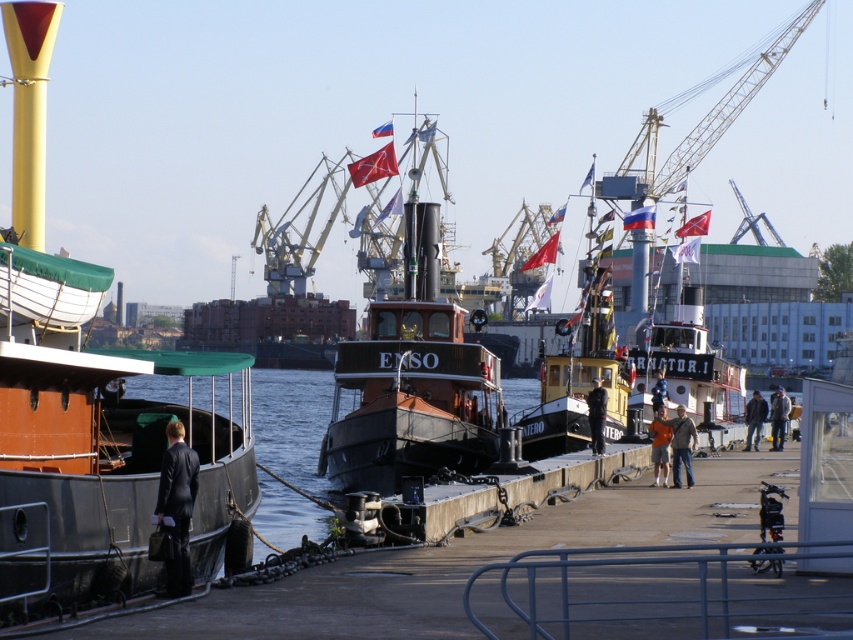
Consider the image. Does brown leather jacket at lower right appear on the right side of red fabric flag at center?

Yes, brown leather jacket at lower right is to the right of red fabric flag at center.

Is point (753, 419) behind point (695, 216)?

No, it is not.

The image size is (853, 640). I want to click on brown leather jacket at lower right, so (x=753, y=419).

Find the location of a particular element. light brown leather jacket at lower right is located at coordinates (682, 444).

Image resolution: width=853 pixels, height=640 pixels. What are the coordinates of `light brown leather jacket at lower right` in the screenshot? It's located at (682, 444).

Can you confirm if brown wooden tugboat at center is positioned to the right of orange cotton shirt at center?

No, brown wooden tugboat at center is not to the right of orange cotton shirt at center.

Can you confirm if brown wooden tugboat at center is wider than orange cotton shirt at center?

Correct, the width of brown wooden tugboat at center exceeds that of orange cotton shirt at center.

Is point (471, 400) closer to camera compared to point (654, 426)?

That is False.

Identify the location of brown wooden tugboat at center. Image resolution: width=853 pixels, height=640 pixels. (413, 380).